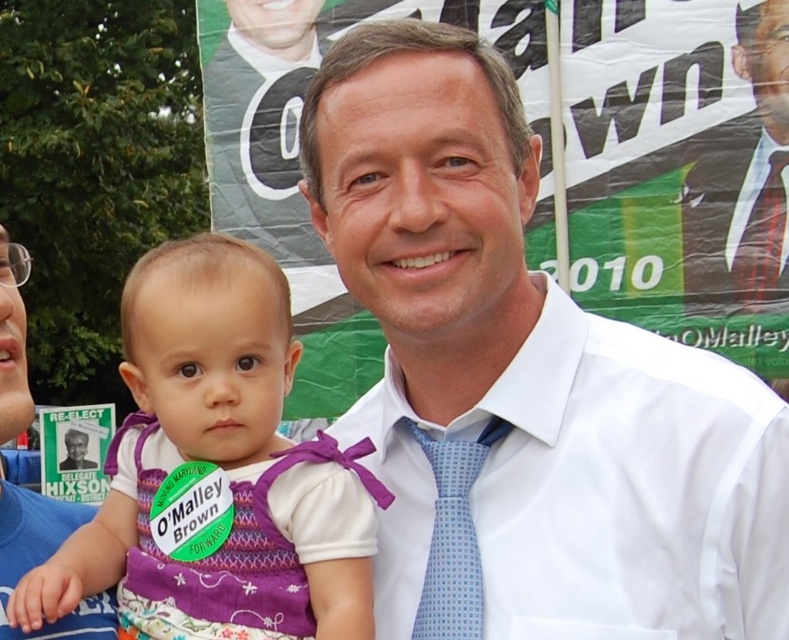
Does smooth black suit at center have a smaller size compared to blue dotted tie at upper right?

Actually, smooth black suit at center might be larger than blue dotted tie at upper right.

Is smooth black suit at center bigger than blue dotted tie at upper right?

Yes, smooth black suit at center is bigger than blue dotted tie at upper right.

Where is `smooth black suit at center`? The image size is (789, 640). smooth black suit at center is located at coordinates (742, 180).

The image size is (789, 640). What are the coordinates of `smooth black suit at center` in the screenshot? It's located at (742, 180).

Describe the element at coordinates (219, 460) in the screenshot. This screenshot has width=789, height=640. I see `purple fabric dress at center` at that location.

What are the coordinates of `purple fabric dress at center` in the screenshot? It's located at (219, 460).

This screenshot has height=640, width=789. What are the coordinates of `purple fabric dress at center` in the screenshot? It's located at (219, 460).

At what (x,y) coordinates should I click in order to perform the action: click on purple fabric dress at center. Please return your answer as a coordinate pair (x, y). The image size is (789, 640). Looking at the image, I should click on (219, 460).

From the picture: Does white shirt at center appear on the left side of blue dotted tie at upper right?

Correct, you'll find white shirt at center to the left of blue dotted tie at upper right.

Is white shirt at center closer to the viewer compared to blue dotted tie at upper right?

That is True.

Which is in front, point (12, 554) or point (761, 296)?

Point (12, 554)

The width and height of the screenshot is (789, 640). Find the location of `white shirt at center`. white shirt at center is located at coordinates [45, 560].